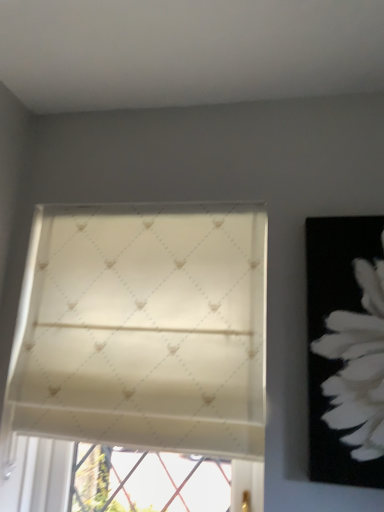
The image size is (384, 512). What do you see at coordinates (143, 328) in the screenshot?
I see `ivory textured fabric at center` at bounding box center [143, 328].

Identify the location of ivory textured fabric at center. (143, 328).

Where is `ivory textured fabric at center`? Image resolution: width=384 pixels, height=512 pixels. ivory textured fabric at center is located at coordinates (143, 328).